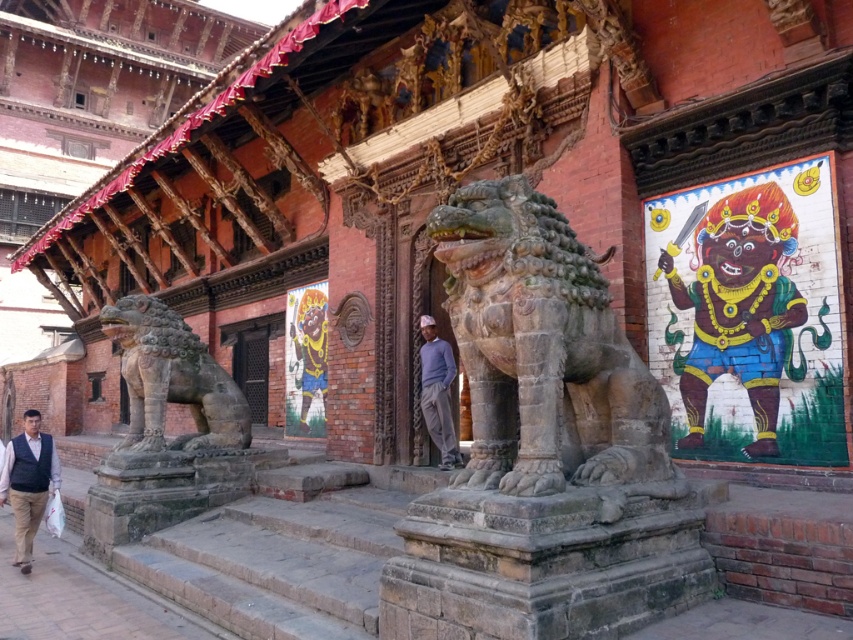
Question: Can you confirm if multicolored painted deity at upper right is positioned below light blue sweater at center?

Choices:
 (A) yes
 (B) no

Answer: (B)

Question: Can you confirm if multicolored painted deity at upper right is positioned above light blue sweater at center?

Choices:
 (A) yes
 (B) no

Answer: (A)

Question: Which point is closer to the camera taking this photo?

Choices:
 (A) (583, 442)
 (B) (422, 348)
 (C) (26, 436)

Answer: (A)

Question: Does rustic stone lion at left have a greater width compared to light blue sweater at center?

Choices:
 (A) no
 (B) yes

Answer: (B)

Question: Based on their relative distances, which object is farther from the carved stone lion at center?

Choices:
 (A) dark blue vest at lower left
 (B) multicolored painted deity at upper right

Answer: (A)

Question: Among these points, which one is farthest from the camera?

Choices:
 (A) (142, 320)
 (B) (605, 429)

Answer: (A)